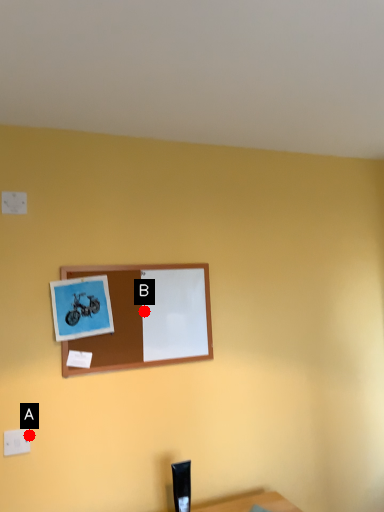
Question: Two points are circled on the image, labeled by A and B beside each circle. Which point appears farthest from the camera in this image?

Choices:
 (A) A is further
 (B) B is further

Answer: (B)